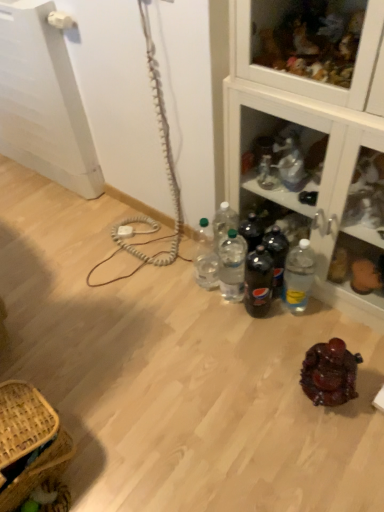
This screenshot has height=512, width=384. What are the coordinates of `free space between shiny brown candy at center and clear plastic bottle at lower right, which appears as the 1th bottle when viewed from the right` in the screenshot? It's located at (304, 337).